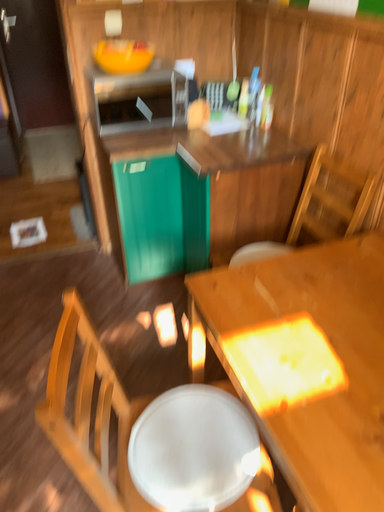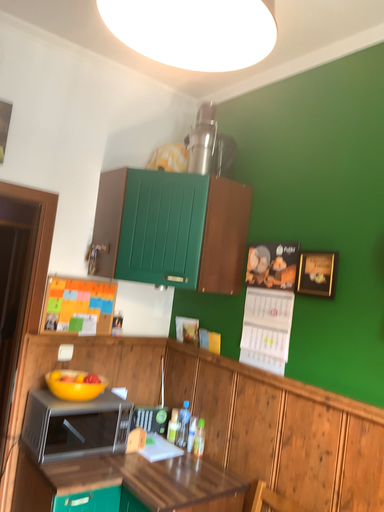
Question: Which way did the camera rotate in the video?

Choices:
 (A) rotated right
 (B) rotated left

Answer: (A)